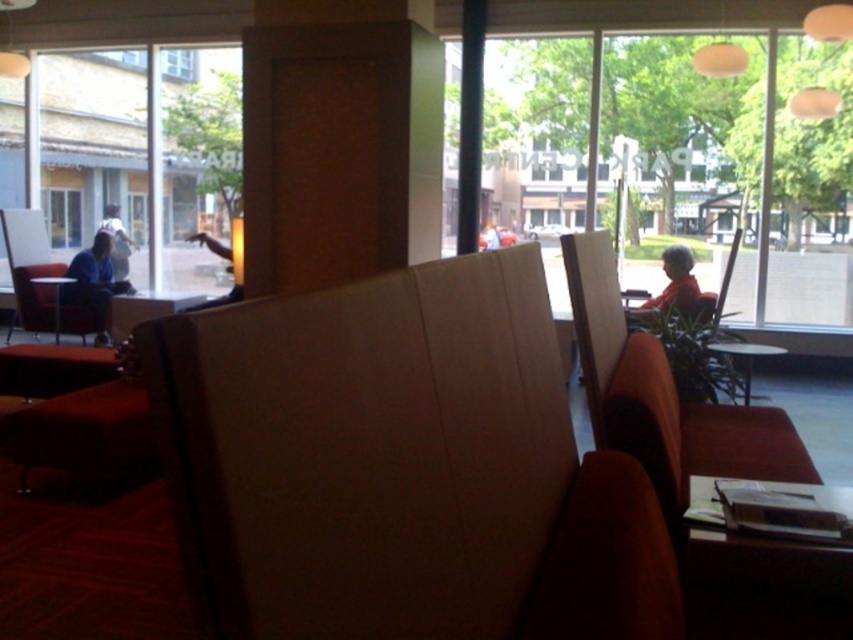
Which is in front, point (91, 272) or point (126, 240)?

Point (91, 272) is more forward.

From the picture: Who is more forward, [96,244] or [128,268]?

Point [96,244] is in front.

Identify the location of blue fabric jacket at left. (93, 284).

Does white glossy table at lower right have a lesser width compared to matte black table at left?

No, white glossy table at lower right is not thinner than matte black table at left.

Can you confirm if white glossy table at lower right is taller than matte black table at left?

Incorrect, white glossy table at lower right's height is not larger of matte black table at left's.

Between point (772, 346) and point (38, 280), which one is positioned behind?

Point (38, 280)

This screenshot has width=853, height=640. I want to click on white glossy table at lower right, so click(x=746, y=356).

Is point (723, 564) closer to viewer compared to point (99, 228)?

Yes, point (723, 564) is closer to viewer.

Consider the image. Who is lower down, wooden table at lower right or white cotton shirt at left?

wooden table at lower right is lower down.

Where is `wooden table at lower right`? The width and height of the screenshot is (853, 640). wooden table at lower right is located at coordinates (764, 588).